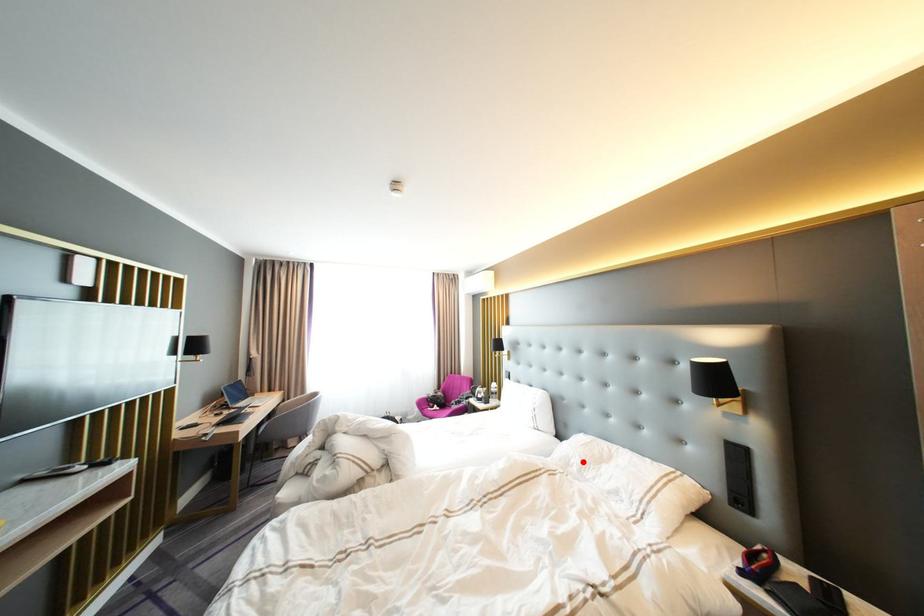
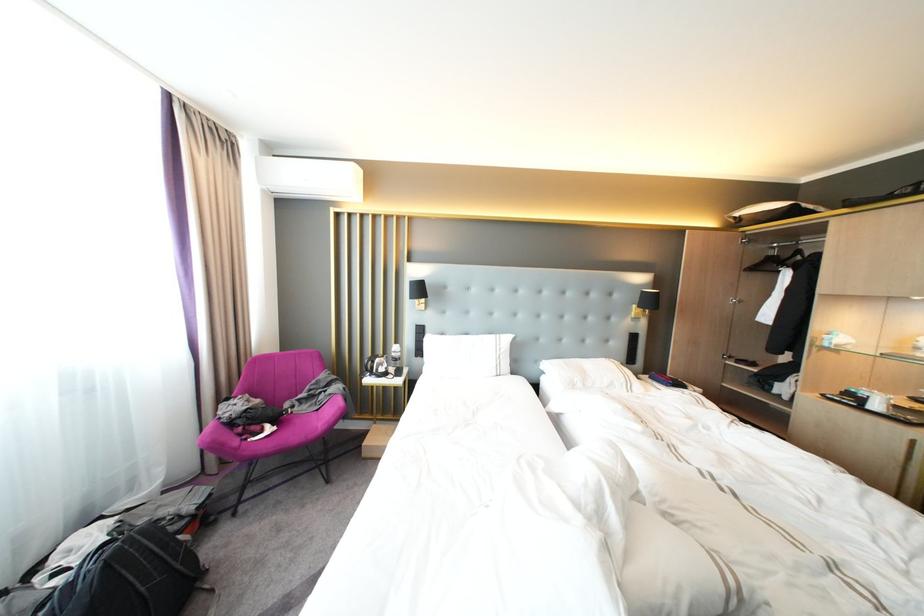
Find the pixel in the second image that matches the highlighted location in the first image.

(586, 382)